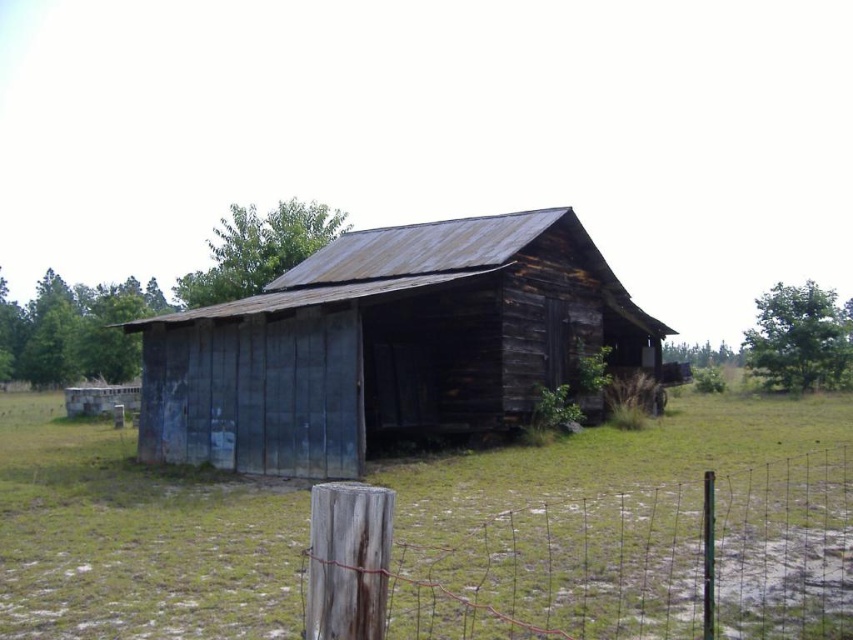
Does point (206, 528) come behind point (564, 333)?

No, (206, 528) is in front of (564, 333).

From the picture: Is green grass at center above weathered wood barn at center?

Actually, green grass at center is below weathered wood barn at center.

Is point (670, 461) in front of point (498, 336)?

Yes, it is.

Find the location of a particular element. This screenshot has width=853, height=640. green grass at center is located at coordinates (136, 538).

Does weathered wood barn at center come in front of weathered wood post at lower left?

No, weathered wood barn at center is further to the viewer.

Can you confirm if weathered wood barn at center is positioned to the left of weathered wood post at lower left?

Indeed, weathered wood barn at center is positioned on the left side of weathered wood post at lower left.

The image size is (853, 640). Identify the location of weathered wood barn at center. (386, 344).

You are a GUI agent. You are given a task and a screenshot of the screen. Output one action in this format:
    pyautogui.click(x=<x>, y=<y>)
    Task: Click on the weathered wood barn at center
    The image size is (853, 640).
    Given the screenshot: What is the action you would take?
    pyautogui.click(x=386, y=344)

Can you confirm if green grass at center is positioned to the left of weathered wood post at lower left?

Yes, green grass at center is to the left of weathered wood post at lower left.

Who is lower down, green grass at center or weathered wood post at lower left?

green grass at center is lower down.

I want to click on green grass at center, so click(x=136, y=538).